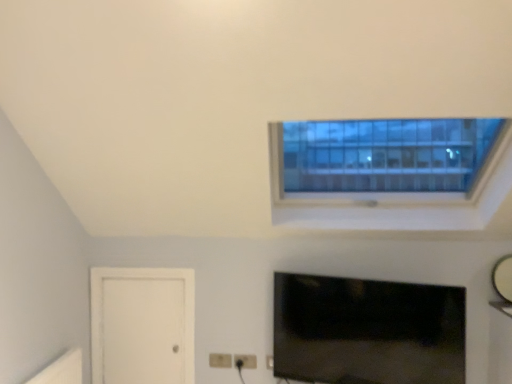
Question: From the image's perspective, is matte black tv at lower center below white plastic electric outlet at lower center?

Choices:
 (A) no
 (B) yes

Answer: (A)

Question: Considering the relative sizes of matte black tv at lower center and white plastic electric outlet at lower center in the image provided, is matte black tv at lower center taller than white plastic electric outlet at lower center?

Choices:
 (A) no
 (B) yes

Answer: (B)

Question: From a real-world perspective, is matte black tv at lower center under white plastic electric outlet at lower center?

Choices:
 (A) no
 (B) yes

Answer: (A)

Question: Could white plastic electric outlet at lower center be considered to be inside matte black tv at lower center?

Choices:
 (A) no
 (B) yes

Answer: (A)

Question: Is matte black tv at lower center to the right of white plastic electric outlet at lower center from the viewer's perspective?

Choices:
 (A) no
 (B) yes

Answer: (B)

Question: Are matte black tv at lower center and white plastic electric outlet at lower center far apart?

Choices:
 (A) yes
 (B) no

Answer: (B)

Question: From a real-world perspective, is glossy silver mirror at upper right positioned over white plastic electric outlet at lower center based on gravity?

Choices:
 (A) no
 (B) yes

Answer: (B)

Question: Is glossy silver mirror at upper right outside white plastic electric outlet at lower center?

Choices:
 (A) yes
 (B) no

Answer: (A)

Question: Considering the relative sizes of glossy silver mirror at upper right and white plastic electric outlet at lower center in the image provided, is glossy silver mirror at upper right bigger than white plastic electric outlet at lower center?

Choices:
 (A) no
 (B) yes

Answer: (B)

Question: Does glossy silver mirror at upper right contain white plastic electric outlet at lower center?

Choices:
 (A) no
 (B) yes

Answer: (A)

Question: Does glossy silver mirror at upper right appear on the right side of white plastic electric outlet at lower center?

Choices:
 (A) yes
 (B) no

Answer: (A)

Question: Can you confirm if glossy silver mirror at upper right is smaller than white plastic electric outlet at lower center?

Choices:
 (A) yes
 (B) no

Answer: (B)

Question: From a real-world perspective, is glossy silver mirror at upper right below matte black tv at lower center?

Choices:
 (A) no
 (B) yes

Answer: (A)